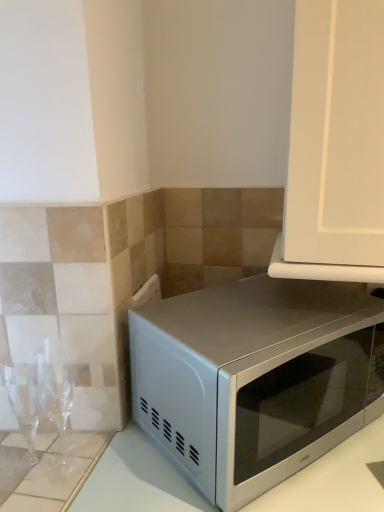
This screenshot has width=384, height=512. What do you see at coordinates (254, 379) in the screenshot? I see `satin silver microwave at lower right` at bounding box center [254, 379].

The width and height of the screenshot is (384, 512). What are the coordinates of `satin silver microwave at lower right` in the screenshot? It's located at (254, 379).

I want to click on satin white microwave at lower right, so click(137, 479).

What do you see at coordinates (137, 479) in the screenshot? This screenshot has height=512, width=384. I see `satin white microwave at lower right` at bounding box center [137, 479].

The width and height of the screenshot is (384, 512). I want to click on satin silver microwave at lower right, so click(x=254, y=379).

Between satin white microwave at lower right and satin silver microwave at lower right, which one appears on the right side from the viewer's perspective?

Positioned to the right is satin white microwave at lower right.

Which object is further away from the camera, satin white microwave at lower right or satin silver microwave at lower right?

satin silver microwave at lower right.

Does point (106, 457) lie behind point (310, 297)?

No, it is not.

From the image's perspective, does satin white microwave at lower right appear lower than satin silver microwave at lower right?

Yes.

From a real-world perspective, is satin white microwave at lower right positioned above or below satin silver microwave at lower right?

In terms of real-world spatial position, satin white microwave at lower right is below satin silver microwave at lower right.

Does satin white microwave at lower right have a lesser width compared to satin silver microwave at lower right?

In fact, satin white microwave at lower right might be wider than satin silver microwave at lower right.

Is satin white microwave at lower right taller or shorter than satin silver microwave at lower right?

satin white microwave at lower right is taller than satin silver microwave at lower right.

Considering the sizes of objects satin white microwave at lower right and satin silver microwave at lower right in the image provided, who is bigger, satin white microwave at lower right or satin silver microwave at lower right?

With larger size is satin white microwave at lower right.

Is satin white microwave at lower right outside of satin silver microwave at lower right?

That's correct, satin white microwave at lower right is outside of satin silver microwave at lower right.

Is satin white microwave at lower right not near satin silver microwave at lower right?

Actually, satin white microwave at lower right and satin silver microwave at lower right are a little close together.

Is satin white microwave at lower right oriented away from satin silver microwave at lower right?

That's not correct — satin white microwave at lower right is not looking away from satin silver microwave at lower right.

Can you tell me how much satin white microwave at lower right and satin silver microwave at lower right differ in facing direction?

The facing directions of satin white microwave at lower right and satin silver microwave at lower right are 49.2 degrees apart.

Measure the distance from satin white microwave at lower right to satin silver microwave at lower right.

They are 15.44 centimeters apart.

The height and width of the screenshot is (512, 384). I want to click on counter top beneath the satin silver microwave at lower right (from a real-world perspective), so [137, 479].

Does satin silver microwave at lower right appear on the right side of satin white microwave at lower right?

In fact, satin silver microwave at lower right is to the left of satin white microwave at lower right.

Considering their positions, is satin silver microwave at lower right located in front of or behind satin white microwave at lower right?

Visually, satin silver microwave at lower right is located behind satin white microwave at lower right.

Does point (247, 446) appear closer or farther from the camera than point (173, 502)?

Clearly, point (247, 446) is closer to the camera than point (173, 502).

From the image's perspective, which is below, satin silver microwave at lower right or satin white microwave at lower right?

satin white microwave at lower right.

From a real-world perspective, is satin silver microwave at lower right located higher than satin white microwave at lower right?

Yes, from a real-world perspective, satin silver microwave at lower right is on top of satin white microwave at lower right.

Can you confirm if satin silver microwave at lower right is wider than satin white microwave at lower right?

No, satin silver microwave at lower right is not wider than satin white microwave at lower right.

Consider the image. Considering the sizes of satin silver microwave at lower right and satin white microwave at lower right in the image, is satin silver microwave at lower right taller or shorter than satin white microwave at lower right?

Clearly, satin silver microwave at lower right is shorter compared to satin white microwave at lower right.

Considering the sizes of objects satin silver microwave at lower right and satin white microwave at lower right in the image provided, who is bigger, satin silver microwave at lower right or satin white microwave at lower right?

satin white microwave at lower right is bigger.

Would you say satin white microwave at lower right is part of satin silver microwave at lower right's contents?

That's incorrect, satin white microwave at lower right is not inside satin silver microwave at lower right.

Does satin silver microwave at lower right touch satin white microwave at lower right?

No, satin silver microwave at lower right is not next to satin white microwave at lower right.

Based on the photo, is satin silver microwave at lower right turned away from satin white microwave at lower right?

satin silver microwave at lower right is not turned away from satin white microwave at lower right.

Locate an element on the screen. The width and height of the screenshot is (384, 512). counter top beneath the satin silver microwave at lower right (from a real-world perspective) is located at coordinates (137, 479).

At what (x,y) coordinates should I click in order to perform the action: click on microwave oven to the left of satin white microwave at lower right. Please return your answer as a coordinate pair (x, y). Looking at the image, I should click on (254, 379).

Where is `microwave oven above the satin white microwave at lower right (from a real-world perspective)`? This screenshot has height=512, width=384. microwave oven above the satin white microwave at lower right (from a real-world perspective) is located at coordinates (254, 379).